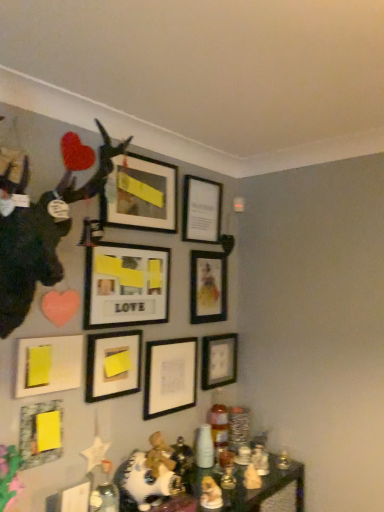
Describe the element at coordinates (113, 365) in the screenshot. I see `matte yellow paper at center, acting as the 6th picture frame starting from the top` at that location.

Describe the element at coordinates (208, 287) in the screenshot. The image size is (384, 512). I see `matte black picture frame at center-right, marked as the 4th picture frame in a top-to-bottom arrangement` at that location.

You are a GUI agent. You are given a task and a screenshot of the screen. Output one action in this format:
    pyautogui.click(x=<x>, y=<y>)
    Task: Click on the black matte deer head at upper left
    This screenshot has height=512, width=384.
    Given the screenshot: What is the action you would take?
    pyautogui.click(x=41, y=231)

This screenshot has height=512, width=384. Find the location of `shiny glass table at lower center`. shiny glass table at lower center is located at coordinates point(263,487).

In order to face yellow paper at lower left, the 5th picture frame when ordered from bottom to top, should I rotate leftwards or rightwards?

To align with it, rotate left about 18.171°.

How much space does yellow paper at lower left, the 5th picture frame when ordered from top to bottom, occupy horizontally?

The width of yellow paper at lower left, the 5th picture frame when ordered from top to bottom, is 2.65 inches.

How much space does yellow matte picture frame at lower left, which ranks as the 9th picture frame in top-to-bottom order, occupy vertically?

yellow matte picture frame at lower left, which ranks as the 9th picture frame in top-to-bottom order, is 8.46 inches tall.

This screenshot has height=512, width=384. What are the coordinates of `yellow matte picture frame at lower left, which ranks as the 9th picture frame in top-to-bottom order` in the screenshot? It's located at (40, 433).

Describe the element at coordinates (219, 360) in the screenshot. This screenshot has height=512, width=384. I see `matte black picture frame at lower right, positioned as the seventh picture frame in top-to-bottom order` at that location.

Image resolution: width=384 pixels, height=512 pixels. I want to click on matte black picture frame at lower right, placed as the 3th picture frame when sorted from bottom to top, so click(x=219, y=360).

Where is `matte yellow paper at center, placed as the fourth picture frame when sorted from bottom to top`? Image resolution: width=384 pixels, height=512 pixels. matte yellow paper at center, placed as the fourth picture frame when sorted from bottom to top is located at coordinates (113, 365).

From the picture: How distant is matte black picture frame at upper center, which ranks as the 1th picture frame in top-to-bottom order, from matte black picture frame at upper center, the second picture frame in the top-to-bottom sequence?

matte black picture frame at upper center, which ranks as the 1th picture frame in top-to-bottom order, and matte black picture frame at upper center, the second picture frame in the top-to-bottom sequence, are 24.63 centimeters apart from each other.

Between matte black picture frame at upper center, which ranks as the 1th picture frame in top-to-bottom order, and matte black picture frame at upper center, the 8th picture frame in the bottom-to-top sequence, which one has smaller width?

Thinner between the two is matte black picture frame at upper center, the 8th picture frame in the bottom-to-top sequence.

From the picture: Is the depth of matte black picture frame at upper center, which ranks as the 1th picture frame in top-to-bottom order, greater than that of matte black picture frame at upper center, the second picture frame in the top-to-bottom sequence?

That is False.

Is matte black picture frame at upper center, which ranks as the 1th picture frame in top-to-bottom order, at the right side of matte black picture frame at upper center, the 8th picture frame in the bottom-to-top sequence?

No.

Where is `the 6th picture frame below the matte black picture frame at upper center, the 8th picture frame in the bottom-to-top sequence (from the image's perspective)`? The height and width of the screenshot is (512, 384). the 6th picture frame below the matte black picture frame at upper center, the 8th picture frame in the bottom-to-top sequence (from the image's perspective) is located at coordinates (170, 376).

Is matte black picture frame at upper center, the 8th picture frame in the bottom-to-top sequence, not near matte black picture frame at center, which appears as the eighth picture frame when viewed from the top?

matte black picture frame at upper center, the 8th picture frame in the bottom-to-top sequence, is near matte black picture frame at center, which appears as the eighth picture frame when viewed from the top, not far away.

Does matte black picture frame at upper center, the 8th picture frame in the bottom-to-top sequence, appear on the right side of matte black picture frame at center, which is the 2th picture frame from bottom to top?

Yes.

From the picture: From their relative heights in the image, would you say matte yellow paper at center, acting as the 6th picture frame starting from the top, is taller or shorter than black matte deer head at upper left?

In the image, matte yellow paper at center, acting as the 6th picture frame starting from the top, appears to be shorter than black matte deer head at upper left.

From a real-world perspective, between matte yellow paper at center, acting as the 6th picture frame starting from the top, and black matte deer head at upper left, who is vertically higher?

black matte deer head at upper left is physically above.

How different are the orientations of matte yellow paper at center, acting as the 6th picture frame starting from the top, and black matte deer head at upper left in degrees?

There is a 3.81-degree angle between the facing directions of matte yellow paper at center, acting as the 6th picture frame starting from the top, and black matte deer head at upper left.

Is matte yellow paper at center, acting as the 6th picture frame starting from the top, positioned far away from black matte deer head at upper left?

No.

From the image's perspective, which picture frame is the 5th one above the matte black picture frame at lower right, placed as the 3th picture frame when sorted from bottom to top? Please provide its 2D coordinates.

[(201, 210)]

From a real-world perspective, who is located lower, matte black picture frame at lower right, positioned as the seventh picture frame in top-to-bottom order, or matte black picture frame at upper center, the 8th picture frame in the bottom-to-top sequence?

matte black picture frame at lower right, positioned as the seventh picture frame in top-to-bottom order, from a real-world perspective.

Can you confirm if matte black picture frame at lower right, positioned as the seventh picture frame in top-to-bottom order, is bigger than matte black picture frame at upper center, the second picture frame in the top-to-bottom sequence?

No, matte black picture frame at lower right, positioned as the seventh picture frame in top-to-bottom order, is not bigger than matte black picture frame at upper center, the second picture frame in the top-to-bottom sequence.

Is matte black picture frame at lower right, placed as the 3th picture frame when sorted from bottom to top, further to the viewer compared to matte black picture frame at upper center, the second picture frame in the top-to-bottom sequence?

Yes, it is.

Does yellow paper at lower left, the 5th picture frame when ordered from bottom to top, appear on the right side of matte black picture frame at upper center, which is the ninth picture frame from bottom to top?

In fact, yellow paper at lower left, the 5th picture frame when ordered from bottom to top, is to the left of matte black picture frame at upper center, which is the ninth picture frame from bottom to top.

Is yellow paper at lower left, the 5th picture frame when ordered from top to bottom, positioned far away from matte black picture frame at upper center, which is the ninth picture frame from bottom to top?

No, yellow paper at lower left, the 5th picture frame when ordered from top to bottom, is in close proximity to matte black picture frame at upper center, which is the ninth picture frame from bottom to top.

Who is smaller, yellow paper at lower left, the 5th picture frame when ordered from bottom to top, or matte black picture frame at upper center, which is the ninth picture frame from bottom to top?

Smaller between the two is yellow paper at lower left, the 5th picture frame when ordered from bottom to top.

From the image's perspective, is yellow paper at lower left, the 5th picture frame when ordered from bottom to top, positioned above or below matte black picture frame at upper center, which ranks as the 1th picture frame in top-to-bottom order?

yellow paper at lower left, the 5th picture frame when ordered from bottom to top, is below matte black picture frame at upper center, which ranks as the 1th picture frame in top-to-bottom order.

Which picture frame is the 5th one when counting from the back of the yellow matte picture frame at lower left, which ranks as the 9th picture frame in top-to-bottom order? Please provide its 2D coordinates.

[(201, 210)]

Can you confirm if yellow matte picture frame at lower left, which ranks as the 9th picture frame in top-to-bottom order, is smaller than matte black picture frame at upper center, the 8th picture frame in the bottom-to-top sequence?

Yes.

Which is more to the right, yellow matte picture frame at lower left, the first picture frame positioned from the bottom, or matte black picture frame at upper center, the 8th picture frame in the bottom-to-top sequence?

matte black picture frame at upper center, the 8th picture frame in the bottom-to-top sequence, is more to the right.

Based on the photo, is yellow matte picture frame at lower left, which ranks as the 9th picture frame in top-to-bottom order, facing towards matte black picture frame at upper center, the second picture frame in the top-to-bottom sequence?

No, yellow matte picture frame at lower left, which ranks as the 9th picture frame in top-to-bottom order, does not turn towards matte black picture frame at upper center, the second picture frame in the top-to-bottom sequence.

Between yellow matte picture frame at lower left, the first picture frame positioned from the bottom, and matte wooden picture frame at center, the 7th picture frame ordered from the bottom, which one is positioned behind?

Positioned behind is matte wooden picture frame at center, the 7th picture frame ordered from the bottom.

From a real-world perspective, is yellow matte picture frame at lower left, which ranks as the 9th picture frame in top-to-bottom order, positioned above or below matte wooden picture frame at center, the 7th picture frame ordered from the bottom?

Clearly, from a real-world perspective, yellow matte picture frame at lower left, which ranks as the 9th picture frame in top-to-bottom order, is below matte wooden picture frame at center, the 7th picture frame ordered from the bottom.

Considering the relative sizes of yellow matte picture frame at lower left, the first picture frame positioned from the bottom, and matte wooden picture frame at center, the 3th picture frame from the top, in the image provided, is yellow matte picture frame at lower left, the first picture frame positioned from the bottom, wider than matte wooden picture frame at center, the 3th picture frame from the top,?

No.

The height and width of the screenshot is (512, 384). In order to click on the 1st picture frame positioned below the matte black picture frame at upper center, which ranks as the 1th picture frame in top-to-bottom order (from a real-world perspective) in this screenshot , I will do `click(201, 210)`.

From the image's perspective, starting from the matte black picture frame at center, which appears as the eighth picture frame when viewed from the top, which picture frame is the 6th one above? Please provide its 2D coordinates.

[(201, 210)]

When comparing their distances from matte black picture frame at upper center, which ranks as the 1th picture frame in top-to-bottom order, does matte black picture frame at lower right, positioned as the seventh picture frame in top-to-bottom order, or matte black picture frame at center-right, which is the sixth picture frame from bottom to top, seem closer?

matte black picture frame at center-right, which is the sixth picture frame from bottom to top, is positioned closer to the anchor matte black picture frame at upper center, which ranks as the 1th picture frame in top-to-bottom order.

From the image, which object appears to be nearer to matte wooden picture frame at center, the 3th picture frame from the top, matte black picture frame at upper center, which is the ninth picture frame from bottom to top, or yellow paper at lower left, the 5th picture frame when ordered from bottom to top?

The object closer to matte wooden picture frame at center, the 3th picture frame from the top, is matte black picture frame at upper center, which is the ninth picture frame from bottom to top.

Looking at the image, which one is located further to matte black picture frame at center-right, marked as the 4th picture frame in a top-to-bottom arrangement, shiny glass table at lower center or matte black picture frame at lower right, placed as the 3th picture frame when sorted from bottom to top?

shiny glass table at lower center lies further to matte black picture frame at center-right, marked as the 4th picture frame in a top-to-bottom arrangement, than the other object.

Based on their spatial positions, is black matte deer head at upper left or yellow paper at lower left, the 5th picture frame when ordered from bottom to top, closer to matte black picture frame at upper center, the second picture frame in the top-to-bottom sequence?

black matte deer head at upper left lies closer to matte black picture frame at upper center, the second picture frame in the top-to-bottom sequence, than the other object.

From the picture: Estimate the real-world distances between objects in this image. Which object is closer to black matte deer head at upper left, matte black picture frame at upper center, which ranks as the 1th picture frame in top-to-bottom order, or matte wooden picture frame at center, the 3th picture frame from the top?

Based on the image, matte black picture frame at upper center, which ranks as the 1th picture frame in top-to-bottom order, appears to be nearer to black matte deer head at upper left.

When comparing their distances from matte black picture frame at center-right, which is the sixth picture frame from bottom to top, does matte black picture frame at center, which appears as the eighth picture frame when viewed from the top, or black matte deer head at upper left seem further?

black matte deer head at upper left lies further to matte black picture frame at center-right, which is the sixth picture frame from bottom to top, than the other object.

From the image, which object appears to be nearer to matte black picture frame at upper center, the 8th picture frame in the bottom-to-top sequence, matte black picture frame at lower right, positioned as the seventh picture frame in top-to-bottom order, or yellow matte picture frame at lower left, which ranks as the 9th picture frame in top-to-bottom order?

matte black picture frame at lower right, positioned as the seventh picture frame in top-to-bottom order, is closer to matte black picture frame at upper center, the 8th picture frame in the bottom-to-top sequence.

Estimate the real-world distances between objects in this image. Which object is further from matte black picture frame at center, which is the 2th picture frame from bottom to top, matte black picture frame at center-right, marked as the 4th picture frame in a top-to-bottom arrangement, or matte black picture frame at upper center, the 8th picture frame in the bottom-to-top sequence?

matte black picture frame at upper center, the 8th picture frame in the bottom-to-top sequence, is further to matte black picture frame at center, which is the 2th picture frame from bottom to top.

Locate an element on the screen. The image size is (384, 512). animal between matte black picture frame at upper center, which ranks as the 1th picture frame in top-to-bottom order, and shiny glass table at lower center from top to bottom is located at coordinates (41, 231).

Where is `animal that lies between matte black picture frame at upper center, which is the ninth picture frame from bottom to top, and yellow matte picture frame at lower left, which ranks as the 9th picture frame in top-to-bottom order, from top to bottom`? This screenshot has width=384, height=512. animal that lies between matte black picture frame at upper center, which is the ninth picture frame from bottom to top, and yellow matte picture frame at lower left, which ranks as the 9th picture frame in top-to-bottom order, from top to bottom is located at coordinates (41, 231).

Identify the location of animal between matte black picture frame at upper center, the second picture frame in the top-to-bottom sequence, and shiny glass table at lower center, in the vertical direction. This screenshot has width=384, height=512. (41, 231).

Find the location of a particular element. Image resolution: width=384 pixels, height=512 pixels. picture frame between matte black picture frame at center, which appears as the eighth picture frame when viewed from the top, and shiny glass table at lower center in the up-down direction is located at coordinates (40, 433).